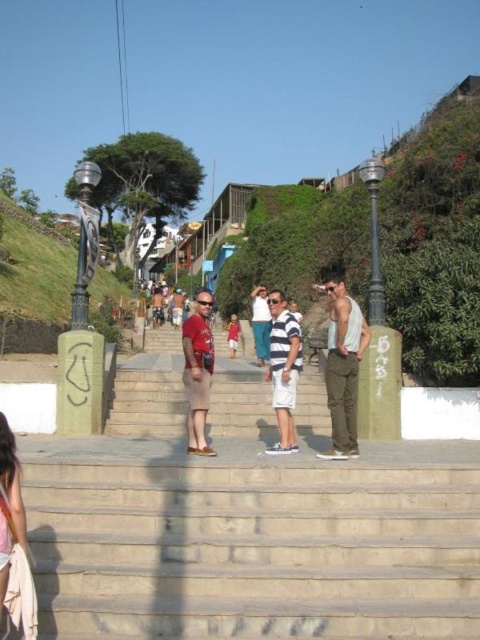
You are standing at the bottom of the staircase and want to take a photo of the concrete stairs at center. According to the coordinates provided, where should you position your camera to capture the stairs at point (248, 524)?

The concrete stairs at center are located at point (248, 524), so you should position your camera at that coordinate to capture them.

You are a photographer trying to capture a group photo of the two people wearing the matte red shirt at center and the white cotton shirt at center. Since you want to make both subjects stand out, you need to position them so that their shirts are clearly visible. Given their sizes, which shirt should be placed closer to the camera to ensure both are visible without overlapping?

The matte red shirt at center is smaller than the white cotton shirt at center. To ensure both are visible without overlapping, the smaller matte red shirt at center should be placed closer to the camera so it appears larger in the photo, balancing its size with the larger white cotton shirt at center.

You are standing at the bottom of the staircase and want to take a photo of the light gray tank top at center and the concrete stairs at center. Which object will appear larger in the photo?

The concrete stairs at center will appear larger in the photo because it is closer to the viewer than the light gray tank top at center.